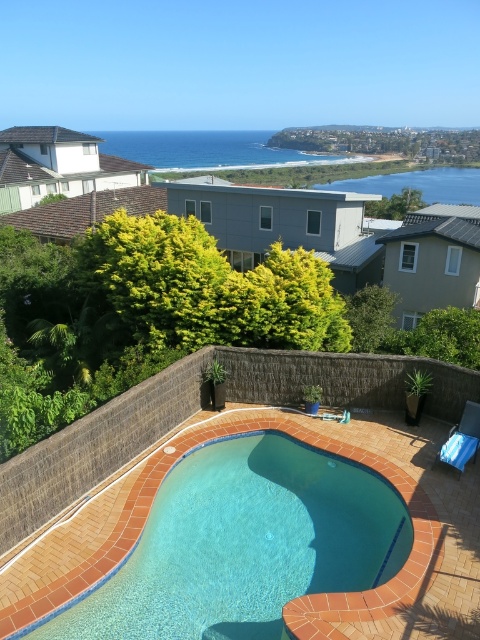
Does clear glass pool at center lie in front of blue water at center?

Yes, clear glass pool at center is in front of blue water at center.

Can you confirm if clear glass pool at center is positioned to the right of blue water at center?

In fact, clear glass pool at center is to the left of blue water at center.

Between point (349, 576) and point (419, 176), which one is positioned in front?

Point (349, 576)

This screenshot has height=640, width=480. What are the coordinates of `clear glass pool at center` in the screenshot? It's located at (244, 545).

Between blue water at upper center and blue water at center, which one has less height?

Standing shorter between the two is blue water at center.

Is blue water at upper center below blue water at center?

Actually, blue water at upper center is above blue water at center.

The height and width of the screenshot is (640, 480). What do you see at coordinates (204, 148) in the screenshot?
I see `blue water at upper center` at bounding box center [204, 148].

The image size is (480, 640). In order to click on blue water at upper center in this screenshot , I will do `click(204, 148)`.

The image size is (480, 640). What do you see at coordinates (244, 545) in the screenshot?
I see `clear glass pool at center` at bounding box center [244, 545].

Can you confirm if clear glass pool at center is bigger than blue water at upper center?

Actually, clear glass pool at center might be smaller than blue water at upper center.

Find the location of a particular element. clear glass pool at center is located at coordinates (244, 545).

Where is `clear glass pool at center`? The width and height of the screenshot is (480, 640). clear glass pool at center is located at coordinates (244, 545).